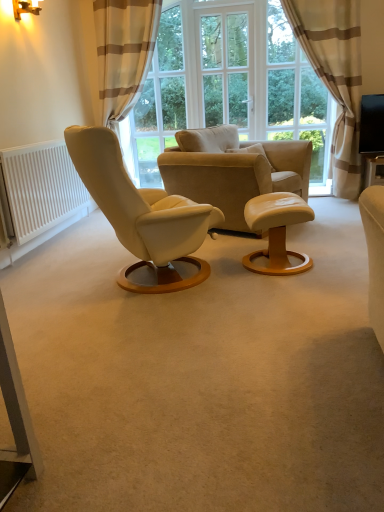
Question: From a real-world perspective, is beige striped curtain at upper right, the first curtain viewed from the right, located beneath matte gold wall lamp at upper left?

Choices:
 (A) no
 (B) yes

Answer: (B)

Question: Is beige striped curtain at upper right, the first curtain viewed from the right, touching matte gold wall lamp at upper left?

Choices:
 (A) no
 (B) yes

Answer: (A)

Question: Would you say matte gold wall lamp at upper left is part of beige striped curtain at upper right, which appears as the second curtain when viewed from the left,'s contents?

Choices:
 (A) no
 (B) yes

Answer: (A)

Question: Is the depth of beige striped curtain at upper right, the first curtain viewed from the right, less than that of matte gold wall lamp at upper left?

Choices:
 (A) no
 (B) yes

Answer: (A)

Question: Is beige striped curtain at upper right, which appears as the second curtain when viewed from the left, smaller than matte gold wall lamp at upper left?

Choices:
 (A) yes
 (B) no

Answer: (B)

Question: Does beige striped curtain at upper right, which appears as the second curtain when viewed from the left, have a lesser width compared to matte gold wall lamp at upper left?

Choices:
 (A) yes
 (B) no

Answer: (B)

Question: Does beige striped curtain at upper right, the first curtain viewed from the right, have a greater width compared to leather armchair at center?

Choices:
 (A) yes
 (B) no

Answer: (B)

Question: Is beige striped curtain at upper right, the first curtain viewed from the right, positioned with its back to leather armchair at center?

Choices:
 (A) yes
 (B) no

Answer: (B)

Question: Is the depth of beige striped curtain at upper right, the first curtain viewed from the right, greater than that of leather armchair at center?

Choices:
 (A) no
 (B) yes

Answer: (B)

Question: From a real-world perspective, does beige striped curtain at upper right, the first curtain viewed from the right, stand above leather armchair at center?

Choices:
 (A) yes
 (B) no

Answer: (A)

Question: Is beige striped curtain at upper right, the first curtain viewed from the right, with leather armchair at center?

Choices:
 (A) no
 (B) yes

Answer: (A)

Question: Is beige striped curtain at upper right, which appears as the second curtain when viewed from the left, not close to leather armchair at center?

Choices:
 (A) no
 (B) yes

Answer: (B)

Question: Is matte white stool at center looking in the opposite direction of white matte radiator at left?

Choices:
 (A) yes
 (B) no

Answer: (B)